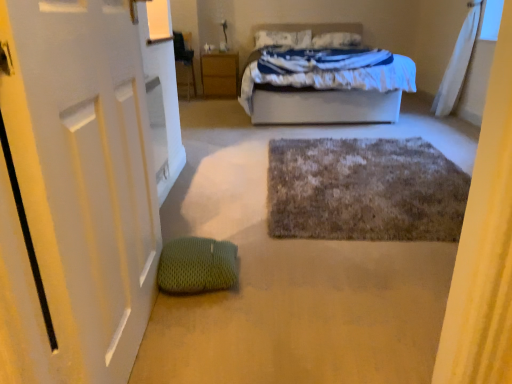
What is the approximate width of fuzzy gray bath mat at center?

It is 5.71 feet.

Describe the element at coordinates (336, 40) in the screenshot. I see `white soft pillow at upper center, the 1th pillow from the right` at that location.

This screenshot has height=384, width=512. Identify the location of white sheer curtain at upper right. (457, 64).

In the image, is wooden nightstand at center on the left side or the right side of white sheer curtain at upper right?

wooden nightstand at center is to the left of white sheer curtain at upper right.

Does wooden nightstand at center come behind white sheer curtain at upper right?

Yes, the depth of wooden nightstand at center is greater than that of white sheer curtain at upper right.

Where is `curtain located in front of the wooden nightstand at center`? The width and height of the screenshot is (512, 384). curtain located in front of the wooden nightstand at center is located at coordinates (457, 64).

Is wooden nightstand at center situated inside white sheer curtain at upper right or outside?

wooden nightstand at center is located beyond the bounds of white sheer curtain at upper right.

Based on the photo, who is taller, wooden nightstand at center or white soft pillow at upper center, which ranks as the second pillow in right-to-left order?

wooden nightstand at center is taller.

How many degrees apart are the facing directions of wooden nightstand at center and white soft pillow at upper center, which is counted as the first pillow, starting from the left?

The facing directions of wooden nightstand at center and white soft pillow at upper center, which is counted as the first pillow, starting from the left, are 1.37 degrees apart.

You are a GUI agent. You are given a task and a screenshot of the screen. Output one action in this format:
    pyautogui.click(x=<x>, y=<y>)
    Task: Click on the nightstand below the white soft pillow at upper center, which ranks as the second pillow in right-to-left order (from the image's perspective)
    
    Given the screenshot: What is the action you would take?
    pyautogui.click(x=220, y=74)

What's the angular difference between white soft pillow at upper center, the 1th pillow from the right, and green textured bean bag at lower left's facing directions?

98.7 degrees.

Can you confirm if white soft pillow at upper center, the second pillow in the left-to-right sequence, is shorter than green textured bean bag at lower left?

No, white soft pillow at upper center, the second pillow in the left-to-right sequence, is not shorter than green textured bean bag at lower left.

Considering the sizes of white soft pillow at upper center, the 1th pillow from the right, and green textured bean bag at lower left in the image, is white soft pillow at upper center, the 1th pillow from the right, wider or thinner than green textured bean bag at lower left?

Clearly, white soft pillow at upper center, the 1th pillow from the right, has more width compared to green textured bean bag at lower left.

Is white soft pillow at upper center, the second pillow in the left-to-right sequence, facing away from green textured bean bag at lower left?

No.

How many degrees apart are the facing directions of green textured bean bag at lower left and white soft bed at center?

There is a 96.2-degree angle between the facing directions of green textured bean bag at lower left and white soft bed at center.

Relative to white soft bed at center, is green textured bean bag at lower left in front or behind?

Visually, green textured bean bag at lower left is located in front of white soft bed at center.

From the image's perspective, relative to white soft bed at center, is green textured bean bag at lower left above or below?

Based on their image positions, green textured bean bag at lower left is located beneath white soft bed at center.

Which is more to the right, green textured bean bag at lower left or white soft bed at center?

white soft bed at center.

From a real-world perspective, who is located lower, white sheer curtain at upper right or white matte door at left?

From a 3D spatial view, white matte door at left is below.

Is point (468, 39) closer to viewer compared to point (7, 225)?

No, (468, 39) is behind (7, 225).

Is white sheer curtain at upper right wider or thinner than white matte door at left?

Clearly, white sheer curtain at upper right has more width compared to white matte door at left.

Do you think white sheer curtain at upper right is within white matte door at left, or outside of it?

white sheer curtain at upper right is not enclosed by white matte door at left.

Looking at this image, who is smaller, white soft pillow at upper center, the second pillow in the left-to-right sequence, or white soft bed at center?

Smaller between the two is white soft pillow at upper center, the second pillow in the left-to-right sequence.

Considering the positions of points (347, 40) and (318, 62), is point (347, 40) farther from camera compared to point (318, 62)?

Yes.

Considering the positions of objects white soft pillow at upper center, the second pillow in the left-to-right sequence, and white soft bed at center in the image provided, who is more to the right, white soft pillow at upper center, the second pillow in the left-to-right sequence, or white soft bed at center?

From the viewer's perspective, white soft pillow at upper center, the second pillow in the left-to-right sequence, appears more on the right side.

In terms of width, does white soft pillow at upper center, the 1th pillow from the right, look wider or thinner when compared to white soft bed at center?

white soft pillow at upper center, the 1th pillow from the right, is thinner than white soft bed at center.

Which of these two, white soft pillow at upper center, the 1th pillow from the right, or wooden nightstand at center, is smaller?

With smaller size is white soft pillow at upper center, the 1th pillow from the right.

The height and width of the screenshot is (384, 512). I want to click on nightstand below the white soft pillow at upper center, the second pillow in the left-to-right sequence (from the image's perspective), so click(x=220, y=74).

Between white soft pillow at upper center, the 1th pillow from the right, and wooden nightstand at center, which one is positioned in front?

wooden nightstand at center.

What's the angular difference between white soft pillow at upper center, the 1th pillow from the right, and wooden nightstand at center's facing directions?

There is a 1.04-degree angle between the facing directions of white soft pillow at upper center, the 1th pillow from the right, and wooden nightstand at center.

Where is `curtain in front of the wooden nightstand at center`? curtain in front of the wooden nightstand at center is located at coordinates (457, 64).

Where is `nightstand below the white soft pillow at upper center, which ranks as the second pillow in right-to-left order (from the image's perspective)`? nightstand below the white soft pillow at upper center, which ranks as the second pillow in right-to-left order (from the image's perspective) is located at coordinates (220, 74).

Which object lies further to the anchor point fuzzy gray bath mat at center, white soft pillow at upper center, which ranks as the second pillow in right-to-left order, or white soft pillow at upper center, the 1th pillow from the right?

white soft pillow at upper center, which ranks as the second pillow in right-to-left order, lies further to fuzzy gray bath mat at center than the other object.

Considering their positions, is white matte door at left positioned closer to wooden nightstand at center than fuzzy gray bath mat at center?

fuzzy gray bath mat at center lies closer to wooden nightstand at center than the other object.

Considering their positions, is green textured bean bag at lower left positioned further to white sheer curtain at upper right than wooden nightstand at center?

green textured bean bag at lower left lies further to white sheer curtain at upper right than the other object.

Which object lies further to the anchor point white matte door at left, white sheer curtain at upper right or white soft bed at center?

Among the two, white sheer curtain at upper right is located further to white matte door at left.

Based on their spatial positions, is fuzzy gray bath mat at center or white soft pillow at upper center, which is counted as the first pillow, starting from the left, closer to wooden nightstand at center?

Among the two, white soft pillow at upper center, which is counted as the first pillow, starting from the left, is located nearer to wooden nightstand at center.

Based on their spatial positions, is fuzzy gray bath mat at center or white soft bed at center closer to white soft pillow at upper center, the 1th pillow from the right?

white soft bed at center is positioned closer to the anchor white soft pillow at upper center, the 1th pillow from the right.

From the image, which object appears to be nearer to green textured bean bag at lower left, wooden nightstand at center or white matte door at left?

The object closer to green textured bean bag at lower left is white matte door at left.

Considering their positions, is white sheer curtain at upper right positioned further to white soft bed at center than green textured bean bag at lower left?

Based on the image, green textured bean bag at lower left appears to be further to white soft bed at center.

You are a GUI agent. You are given a task and a screenshot of the screen. Output one action in this format:
    pyautogui.click(x=<x>, y=<y>)
    Task: Click on the curtain between fuzzy gray bath mat at center and white soft pillow at upper center, which ranks as the second pillow in right-to-left order, from front to back
    
    Given the screenshot: What is the action you would take?
    pyautogui.click(x=457, y=64)

You are a GUI agent. You are given a task and a screenshot of the screen. Output one action in this format:
    pyautogui.click(x=<x>, y=<y>)
    Task: Click on the nightstand between fuzzy gray bath mat at center and white soft pillow at upper center, the second pillow in the left-to-right sequence, from front to back
    The height and width of the screenshot is (384, 512).
    Given the screenshot: What is the action you would take?
    pyautogui.click(x=220, y=74)

Identify the location of bed between fuzzy gray bath mat at center and white soft pillow at upper center, the second pillow in the left-to-right sequence, from front to back. Image resolution: width=512 pixels, height=384 pixels. (327, 87).

Image resolution: width=512 pixels, height=384 pixels. I want to click on curtain between white matte door at left and white soft pillow at upper center, which ranks as the second pillow in right-to-left order, in the front-back direction, so click(x=457, y=64).